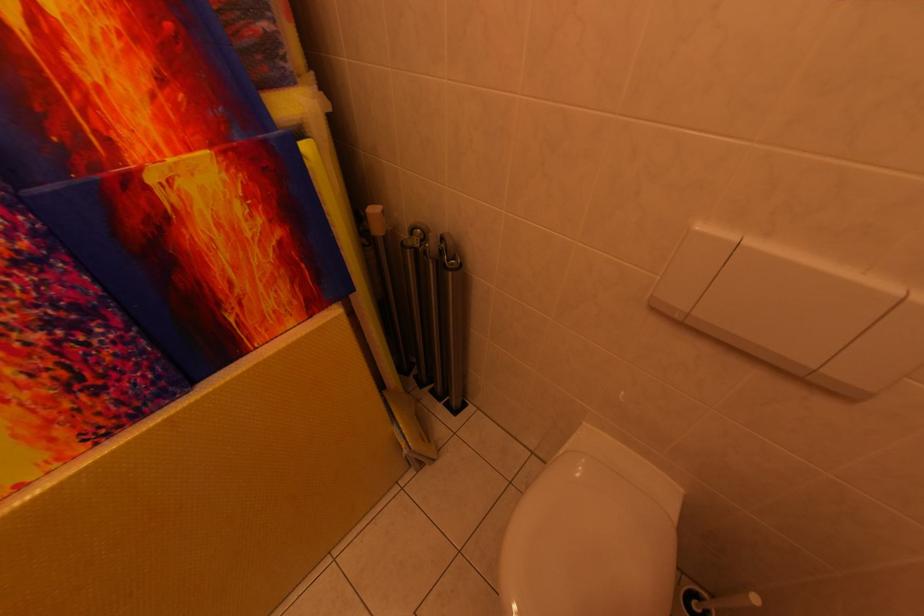
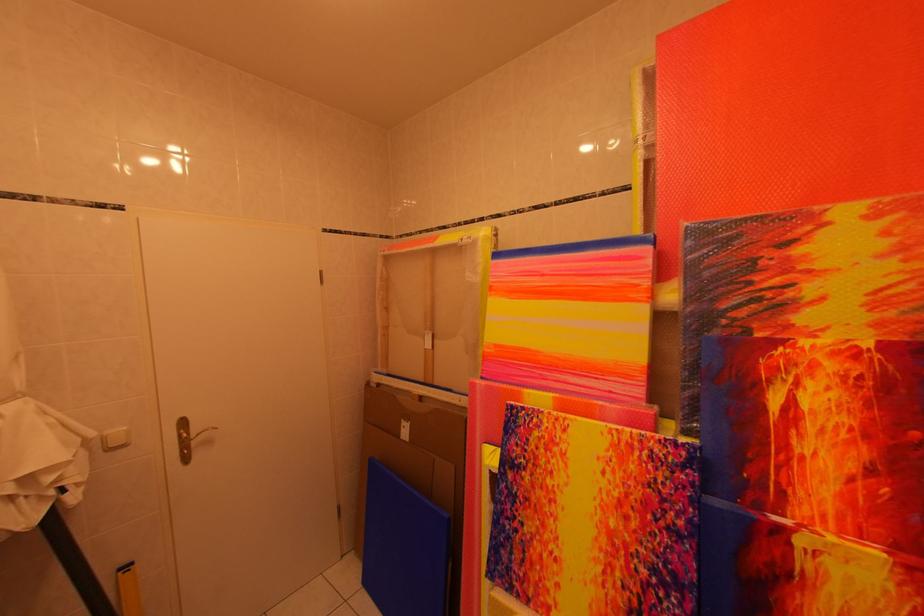
Question: The camera is either moving clockwise (left) or counter-clockwise (right) around the object. The first image is from the beginning of the video and the second image is from the end. Is the camera moving left or right when shooting the video?

Choices:
 (A) Left
 (B) Right

Answer: (B)